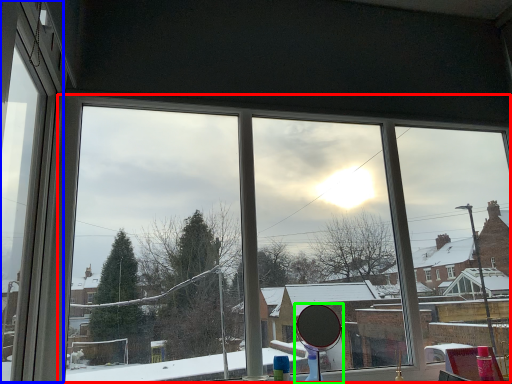
Question: Considering the real-world distances, which object is closest to bay window (highlighted by a red box)? window frame (highlighted by a blue box) or mirror (highlighted by a green box).

Choices:
 (A) window frame
 (B) mirror

Answer: (B)